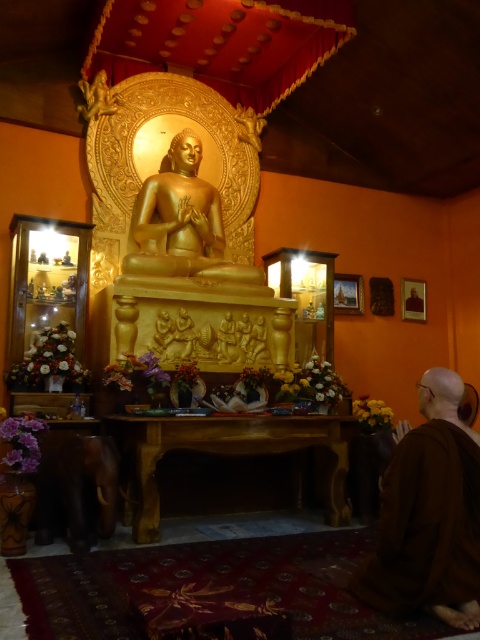
Who is more forward, (420,474) or (194,166)?

Point (420,474)

Does brown cloth at lower right appear on the left side of gold polished statue at center?

Incorrect, brown cloth at lower right is not on the left side of gold polished statue at center.

Who is more distant from viewer, [396,492] or [194,228]?

The point [194,228] is more distant.

The width and height of the screenshot is (480, 640). In order to click on brown cloth at lower right in this screenshot , I will do [425, 524].

Is gold polished statue at center positioned before gold polished statue at upper center?

Yes, it is.

Is gold polished statue at center shorter than gold polished statue at upper center?

In fact, gold polished statue at center may be taller than gold polished statue at upper center.

Which is behind, point (137, 227) or point (81, 88)?

The point (81, 88) is more distant.

Where is `gold polished statue at center`? The image size is (480, 640). gold polished statue at center is located at coordinates (181, 221).

Between brown cloth at lower right and gold polished statue at upper center, which one has less height?

Standing shorter between the two is gold polished statue at upper center.

Which is in front, point (398, 515) or point (108, 106)?

Positioned in front is point (398, 515).

The image size is (480, 640). Find the location of `brown cloth at lower right`. brown cloth at lower right is located at coordinates (425, 524).